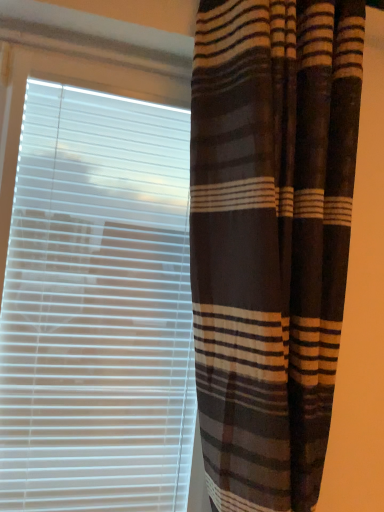
Question: Can you confirm if brown striped curtain at right is shorter than white plastic blinds at left?

Choices:
 (A) yes
 (B) no

Answer: (B)

Question: From the image's perspective, is brown striped curtain at right on top of white plastic blinds at left?

Choices:
 (A) no
 (B) yes

Answer: (B)

Question: Could white plastic blinds at left be considered to be inside brown striped curtain at right?

Choices:
 (A) no
 (B) yes

Answer: (A)

Question: Is brown striped curtain at right smaller than white plastic blinds at left?

Choices:
 (A) no
 (B) yes

Answer: (A)

Question: Would you say brown striped curtain at right is a long distance from white plastic blinds at left?

Choices:
 (A) yes
 (B) no

Answer: (B)

Question: Considering the relative sizes of brown striped curtain at right and white plastic blinds at left in the image provided, is brown striped curtain at right thinner than white plastic blinds at left?

Choices:
 (A) yes
 (B) no

Answer: (B)

Question: Is white plastic blinds at left in contact with brown striped curtain at right?

Choices:
 (A) yes
 (B) no

Answer: (B)

Question: Is white plastic blinds at left oriented towards brown striped curtain at right?

Choices:
 (A) no
 (B) yes

Answer: (A)

Question: Does white plastic blinds at left have a greater height compared to brown striped curtain at right?

Choices:
 (A) yes
 (B) no

Answer: (B)

Question: Does white plastic blinds at left have a lesser width compared to brown striped curtain at right?

Choices:
 (A) no
 (B) yes

Answer: (B)

Question: Considering the relative positions of white plastic blinds at left and brown striped curtain at right in the image provided, is white plastic blinds at left in front of brown striped curtain at right?

Choices:
 (A) yes
 (B) no

Answer: (B)

Question: Does white plastic blinds at left have a greater width compared to brown striped curtain at right?

Choices:
 (A) no
 (B) yes

Answer: (A)

Question: Is point (26, 351) closer or farther from the camera than point (205, 40)?

Choices:
 (A) closer
 (B) farther

Answer: (B)